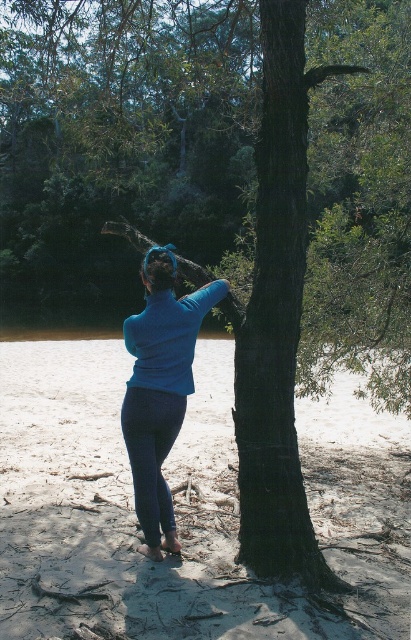
Based on the photo, you are a photographer trying to capture the perfect shot of the sandy textured sand at center and the blue matte leggings at center. Based on their positions, which object should you adjust your camera focus on first if you want to ensure both are in focus?

The sandy textured sand at center is to the left of the blue matte leggings at center. Since they are positioned side by side, adjusting focus on the closer object first would help ensure both are in focus. However, without knowing their distance from the camera, it is difficult to determine which one is closer. Please provide more information about their depth positions.

You are a photographer trying to capture the scene from the front of the person. Which object, the sandy textured sand at center or the blue matte leggings at center, would be closer to your camera lens?

The sandy textured sand at center is in front of the blue matte leggings at center, so the sandy textured sand at center would be closer to the camera lens.